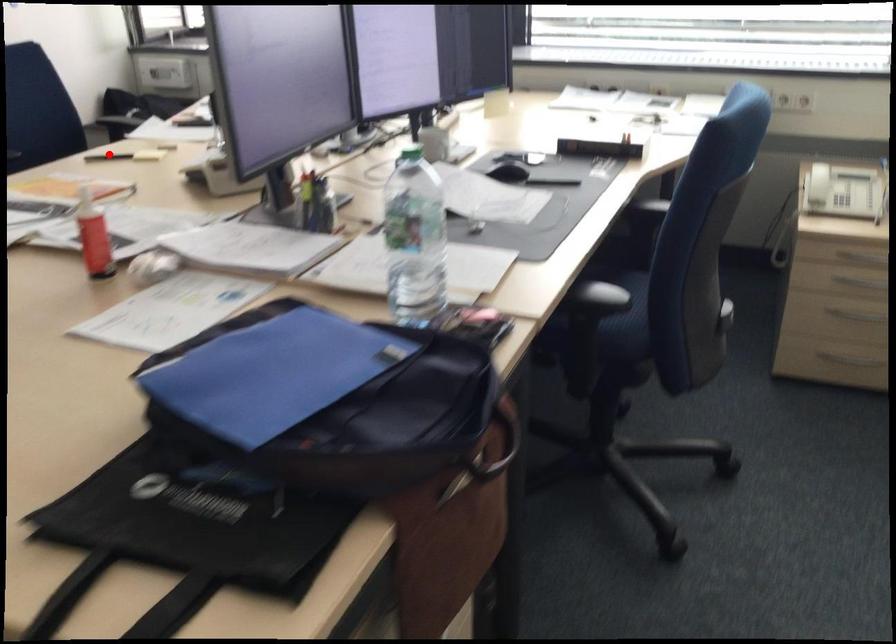
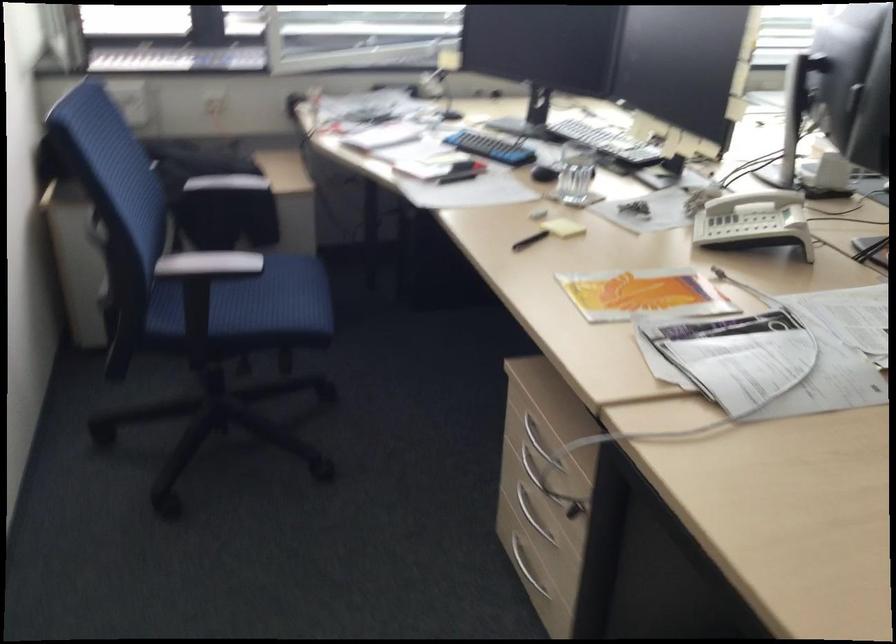
Locate, in the second image, the point that corresponds to the highlighted location in the first image.

(530, 240)